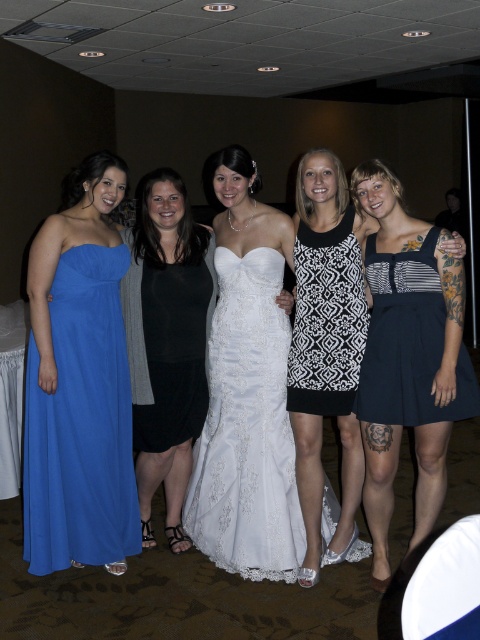
Based on the scene description, which dress is shorter in length between the matte blue dress at left and the white lace dress at center?

The matte blue dress at left is shorter than the white lace dress at center.

You are a photographer trying to capture a group photo of the women in the image. You need to ensure that the white lace dress at center and the black and white printed dress at center are both clearly visible in the frame. Given that your camera has a minimum focus distance of 12 inches, will you be able to focus on both dresses simultaneously?

The white lace dress at center is 11.65 inches from the black and white printed dress at center. Since the distance between them is less than the camera minimum focus distance of 12 inches, the camera cannot focus on both dresses simultaneously.

You are a photographer trying to capture a group photo of the women in the scene. Given that the white lace dress at center and the black and white printed dress at center are both central, which dress requires more space to avoid being cropped out of the frame?

The white lace dress at center requires more space because its width is larger than the black and white printed dress at center, so it needs more room to fit entirely within the frame.